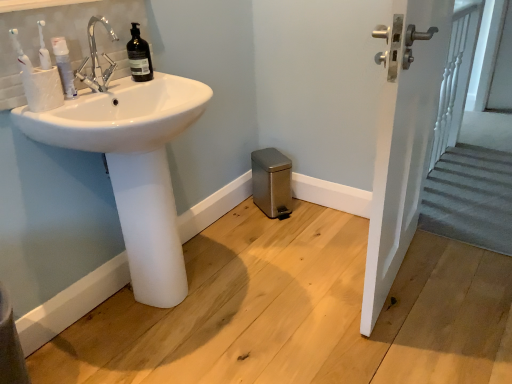
Locate an element on the screen. Image resolution: width=512 pixels, height=384 pixels. vacant region to the left of satin silver trash can at lower center is located at coordinates (240, 211).